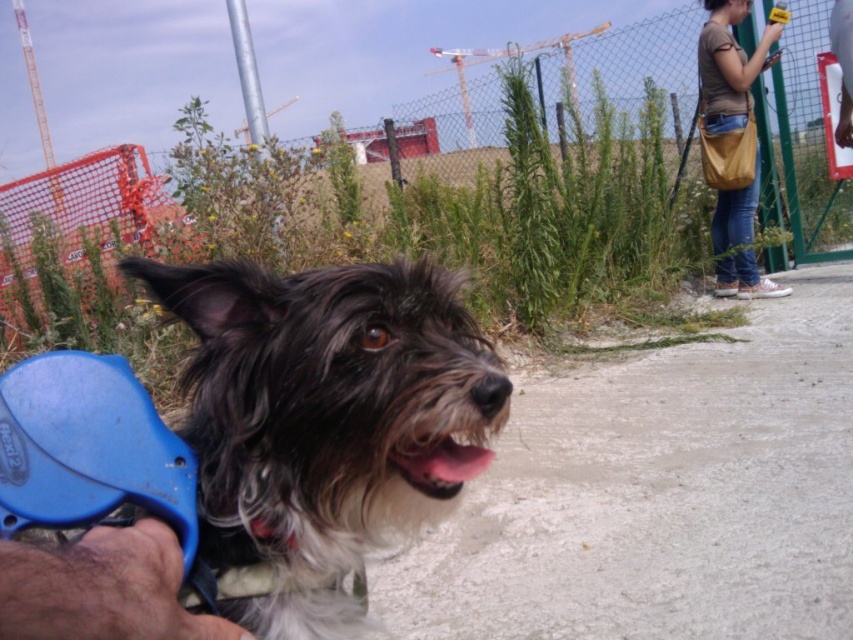
Question: Does fuzzy black dog at center appear under fuzzy fur dog at center?

Choices:
 (A) no
 (B) yes

Answer: (A)

Question: Among these points, which one is farthest from the camera?

Choices:
 (A) (315, 291)
 (B) (712, 48)

Answer: (B)

Question: Which is nearer to the metal mesh fence at center?

Choices:
 (A) fuzzy black dog at center
 (B) fuzzy fur dog at center

Answer: (A)

Question: Which object is closer to the camera taking this photo?

Choices:
 (A) fuzzy fur dog at center
 (B) metal mesh fence at center
 (C) denim jeans at right

Answer: (A)

Question: Does fuzzy black dog at center appear on the right side of denim jeans at right?

Choices:
 (A) yes
 (B) no

Answer: (B)

Question: Does fuzzy black dog at center have a larger size compared to metal mesh fence at center?

Choices:
 (A) no
 (B) yes

Answer: (A)